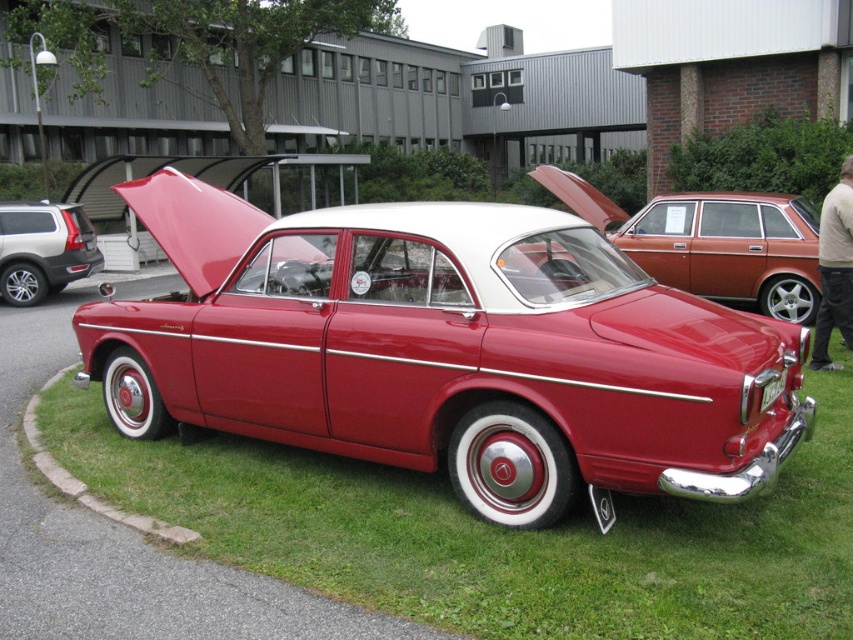
In the scene shown: You are standing at the point marked by coordinates point (x=445, y=349). What object is located at this point?

The glossy red car at center is located at point (x=445, y=349).

You are a photographer wanting to capture the shiny red car at center and the green grass at lower center in your shot. Which object is positioned to the left of the other?

The green grass at lower center is to the left of the shiny red car at center.